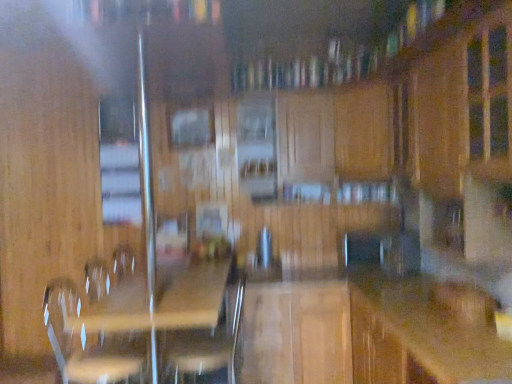
Question: Is wooden swivel chair at center, arranged as the second swivel chair when viewed from the left, closer to camera compared to clear plastic swivel chair at lower left, the 2th swivel chair viewed from the right?

Choices:
 (A) yes
 (B) no

Answer: (B)

Question: Is wooden swivel chair at center, the 1th swivel chair when ordered from right to left, facing towards clear plastic swivel chair at lower left, placed as the first swivel chair when sorted from left to right?

Choices:
 (A) yes
 (B) no

Answer: (A)

Question: Is wooden swivel chair at center, the 1th swivel chair when ordered from right to left, outside of clear plastic swivel chair at lower left, the 2th swivel chair viewed from the right?

Choices:
 (A) yes
 (B) no

Answer: (A)

Question: Can clear plastic swivel chair at lower left, the 2th swivel chair viewed from the right, be found inside wooden swivel chair at center, arranged as the second swivel chair when viewed from the left?

Choices:
 (A) no
 (B) yes

Answer: (A)

Question: Is wooden swivel chair at center, the 1th swivel chair when ordered from right to left, shorter than clear plastic swivel chair at lower left, the 2th swivel chair viewed from the right?

Choices:
 (A) yes
 (B) no

Answer: (B)

Question: In terms of height, does clear plastic swivel chair at lower left, the 2th swivel chair viewed from the right, look taller or shorter compared to wooden counter top at center?

Choices:
 (A) short
 (B) tall

Answer: (A)

Question: In terms of size, does clear plastic swivel chair at lower left, the 2th swivel chair viewed from the right, appear bigger or smaller than wooden counter top at center?

Choices:
 (A) big
 (B) small

Answer: (B)

Question: In terms of width, does clear plastic swivel chair at lower left, placed as the first swivel chair when sorted from left to right, look wider or thinner when compared to wooden counter top at center?

Choices:
 (A) thin
 (B) wide

Answer: (A)

Question: Considering their positions, is clear plastic swivel chair at lower left, placed as the first swivel chair when sorted from left to right, located in front of or behind wooden counter top at center?

Choices:
 (A) behind
 (B) front

Answer: (A)

Question: Is wooden swivel chair at center, arranged as the second swivel chair when viewed from the left, spatially inside clear wood picnic table at center, or outside of it?

Choices:
 (A) outside
 (B) inside

Answer: (B)

Question: From a real-world perspective, is wooden swivel chair at center, the 1th swivel chair when ordered from right to left, physically located above or below clear wood picnic table at center?

Choices:
 (A) above
 (B) below

Answer: (A)

Question: Looking at their shapes, would you say wooden swivel chair at center, the 1th swivel chair when ordered from right to left, is wider or thinner than clear wood picnic table at center?

Choices:
 (A) wide
 (B) thin

Answer: (B)

Question: In the image, is wooden swivel chair at center, the 1th swivel chair when ordered from right to left, positioned in front of or behind clear wood picnic table at center?

Choices:
 (A) behind
 (B) front

Answer: (A)

Question: In the image, is clear wood picnic table at center positioned in front of or behind wooden swivel chair at center, arranged as the second swivel chair when viewed from the left?

Choices:
 (A) front
 (B) behind

Answer: (A)

Question: From the image's perspective, is clear wood picnic table at center positioned above or below wooden swivel chair at center, the 1th swivel chair when ordered from right to left?

Choices:
 (A) below
 (B) above

Answer: (A)